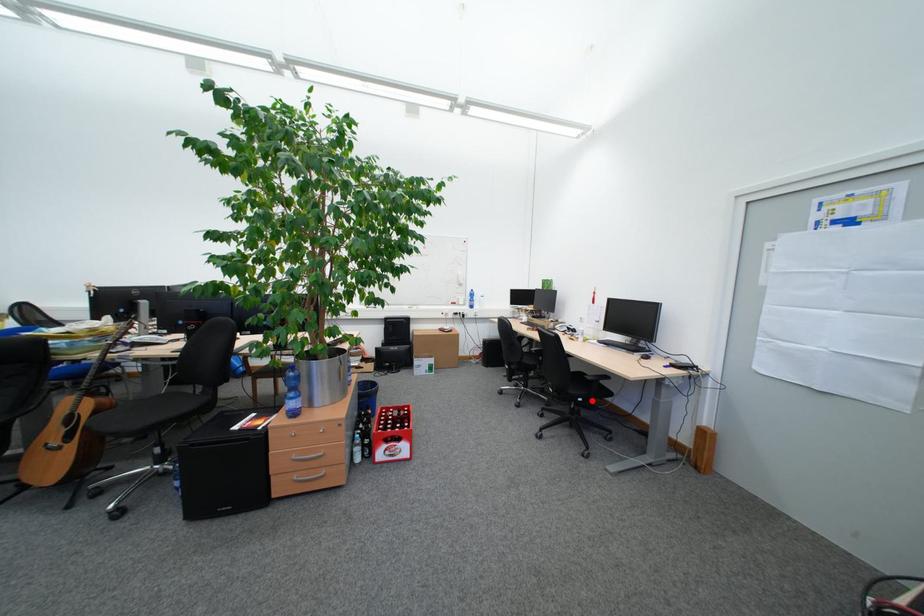
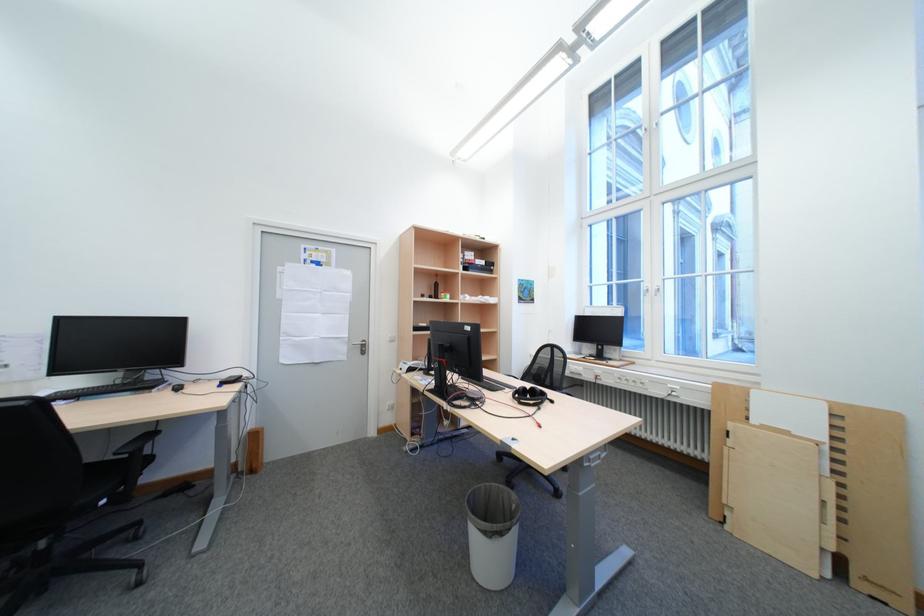
Question: I am providing you with two images of the same scene from different viewpoints. A red point is marked on the first image. Can you still see the location of the red point in image 2?

Choices:
 (A) Yes
 (B) No

Answer: (A)